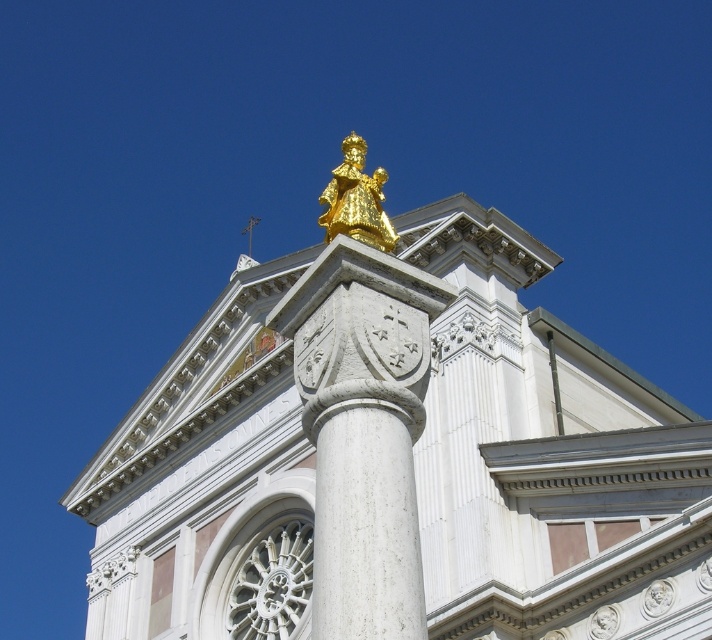
Question: In this image, where is white marble column at upper center located relative to gold polished statue at upper center?

Choices:
 (A) above
 (B) below

Answer: (B)

Question: Can you confirm if gold statue at center is positioned to the left of white marble column at upper center?

Choices:
 (A) no
 (B) yes

Answer: (A)

Question: Does white marble column at center appear on the right side of gold polished statue at upper center?

Choices:
 (A) yes
 (B) no

Answer: (A)

Question: Estimate the real-world distances between objects in this image. Which object is closer to the gold statue at center?

Choices:
 (A) white marble column at center
 (B) gold polished statue at upper center

Answer: (A)

Question: Among these points, which one is nearest to the camera?

Choices:
 (A) (340, 182)
 (B) (365, 513)
 (C) (544, 413)
 (D) (384, 474)

Answer: (B)

Question: Considering the real-world distances, which object is closest to the white marble column at center?

Choices:
 (A) gold polished statue at upper center
 (B) gold statue at center
 (C) white marble column at upper center

Answer: (C)